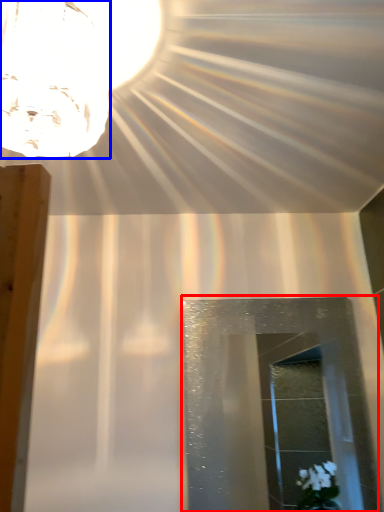
Question: Which of the following is the farthest to the observer, glass door (highlighted by a red box) or lamp (highlighted by a blue box)?

Choices:
 (A) glass door
 (B) lamp

Answer: (A)